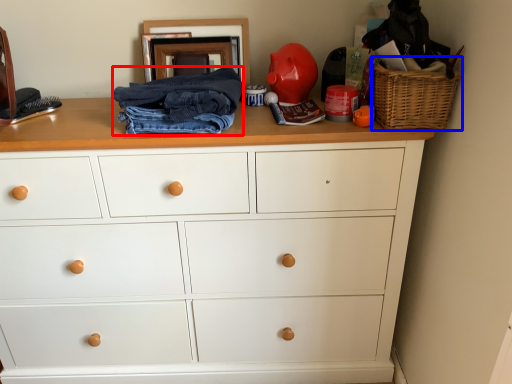
Question: Which point is closer to the camera, clothing (highlighted by a red box) or basket (highlighted by a blue box)?

Choices:
 (A) clothing
 (B) basket

Answer: (B)